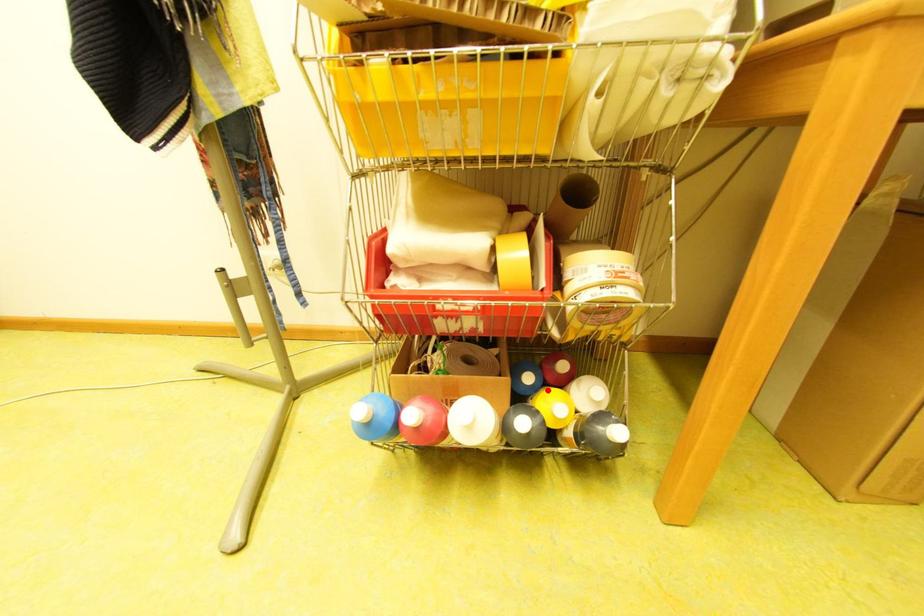
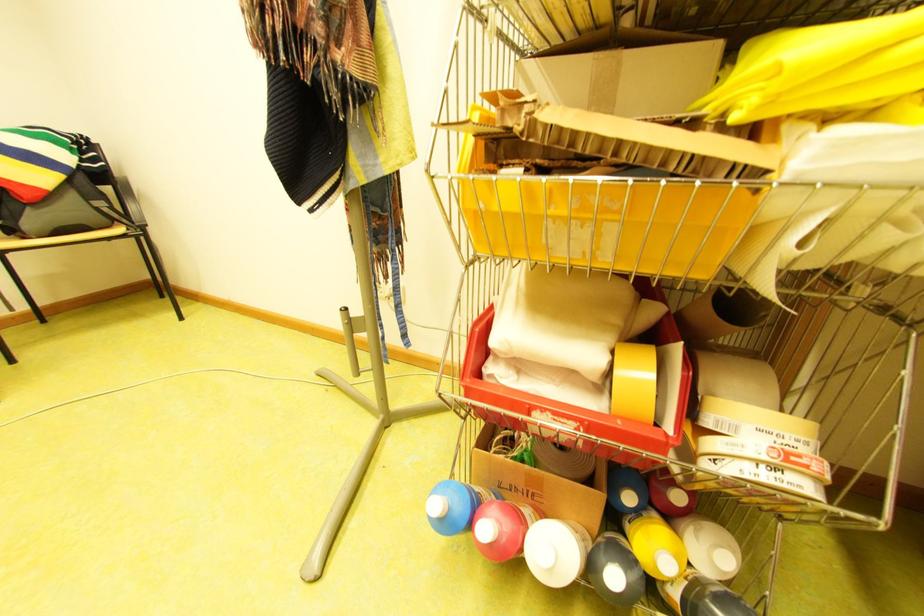
In the second image, find the point that corresponds to the highlighted location in the first image.

(649, 513)